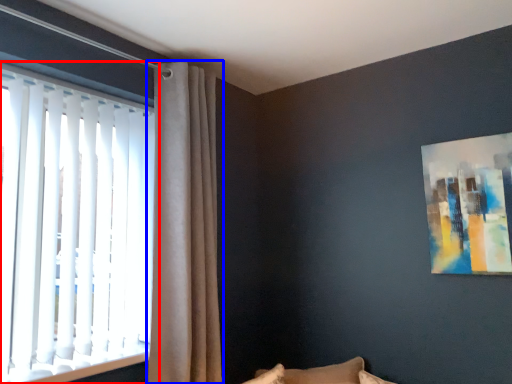
Question: Among these objects, which one is farthest to the camera, window (highlighted by a red box) or curtain (highlighted by a blue box)?

Choices:
 (A) window
 (B) curtain

Answer: (B)